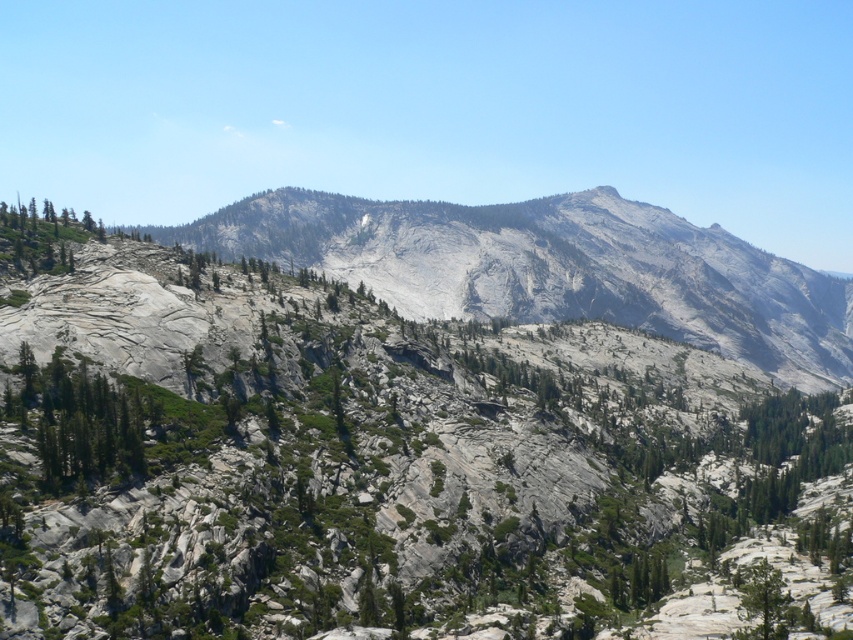
Which is in front, point (300, 225) or point (775, 572)?

Positioned in front is point (775, 572).

Between gray/rocky mountain at center and green leafy tree at lower right, which one is positioned lower?

green leafy tree at lower right is below.

Does point (689, 300) come behind point (767, 628)?

That is True.

Locate an element on the screen. This screenshot has width=853, height=640. gray/rocky mountain at center is located at coordinates (553, 268).

How far apart are gray/rocky mountain at center and green leafy tree at lower left?

The distance of gray/rocky mountain at center from green leafy tree at lower left is 264.18 meters.

Based on the photo, who is more forward, (x=837, y=316) or (x=68, y=385)?

Point (x=68, y=385)

Measure the distance between gray/rocky mountain at center and camera.

The distance of gray/rocky mountain at center from camera is 301.47 meters.

Where is `gray/rocky mountain at center`? gray/rocky mountain at center is located at coordinates (553, 268).

Does green leafy tree at lower left have a greater height compared to green leafy tree at lower right?

Yes.

The height and width of the screenshot is (640, 853). Describe the element at coordinates (76, 420) in the screenshot. I see `green leafy tree at lower left` at that location.

What do you see at coordinates (76, 420) in the screenshot? This screenshot has width=853, height=640. I see `green leafy tree at lower left` at bounding box center [76, 420].

Locate an element on the screen. Image resolution: width=853 pixels, height=640 pixels. green leafy tree at lower left is located at coordinates (76, 420).